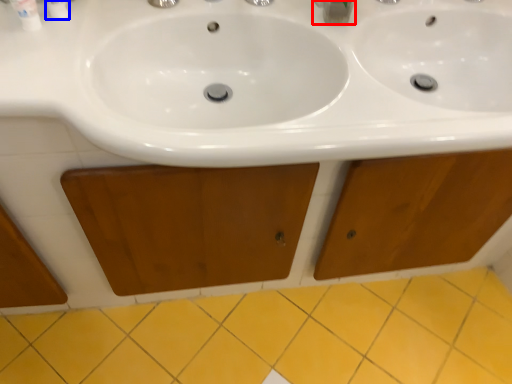
Question: Which object appears closest to the camera in this image, plumbing fixture (highlighted by a red box) or toiletry (highlighted by a blue box)?

Choices:
 (A) plumbing fixture
 (B) toiletry

Answer: (B)